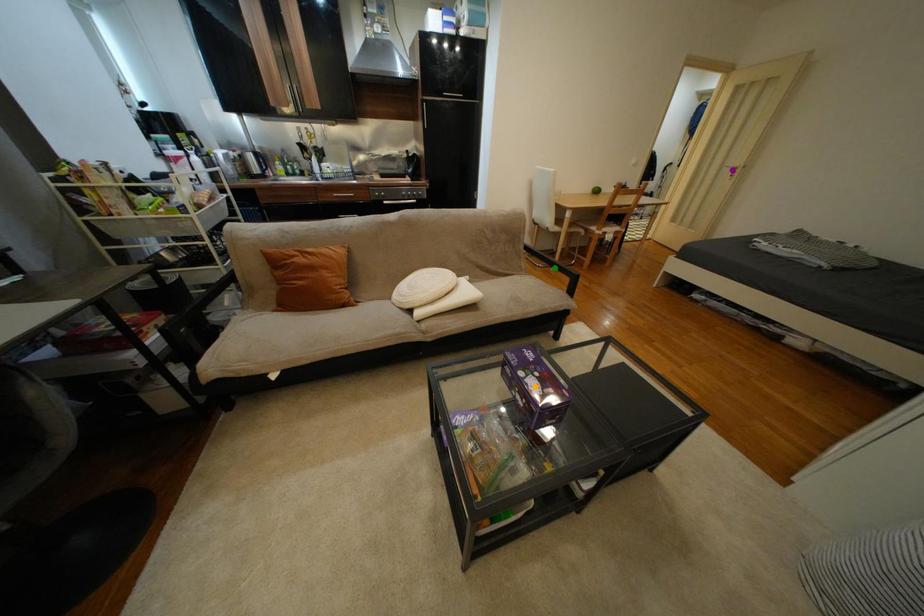
Order these from nearest to farthest:
A) purple point
B) orange point
C) green point

orange point < green point < purple point